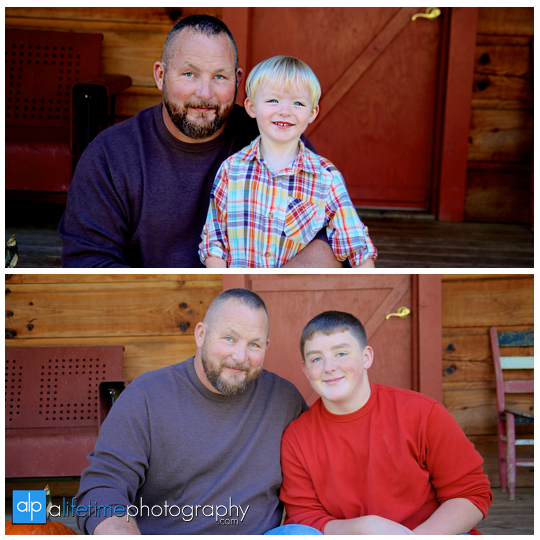
At what (x,y) coordinates should I click in order to perform the action: click on golden door handle. Please return your answer as a coordinate pair (x, y). Looking at the image, I should click on (405, 312), (436, 12).